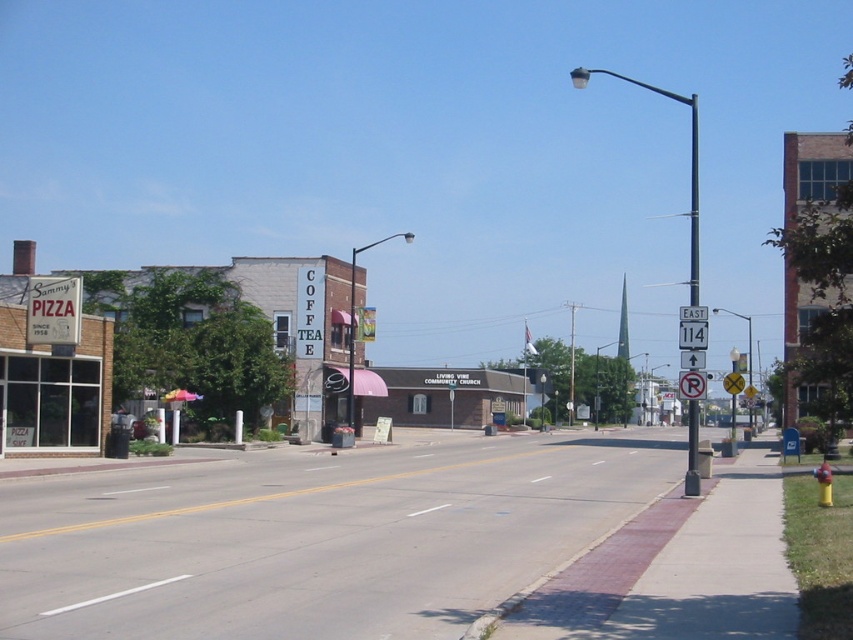
Question: Which point appears farthest from the camera in this image?

Choices:
 (A) (697, 417)
 (B) (691, 182)

Answer: (B)

Question: Can you confirm if white plastic street sign at upper right is bigger than metallic pole at right?

Choices:
 (A) no
 (B) yes

Answer: (A)

Question: Does white plastic street sign at upper right appear under metallic pole at right?

Choices:
 (A) no
 (B) yes

Answer: (A)

Question: Among these points, which one is nearest to the camera?

Choices:
 (A) [689, 476]
 (B) [697, 410]

Answer: (B)

Question: Can you confirm if white plastic street sign at upper right is smaller than metallic pole at right?

Choices:
 (A) no
 (B) yes

Answer: (B)